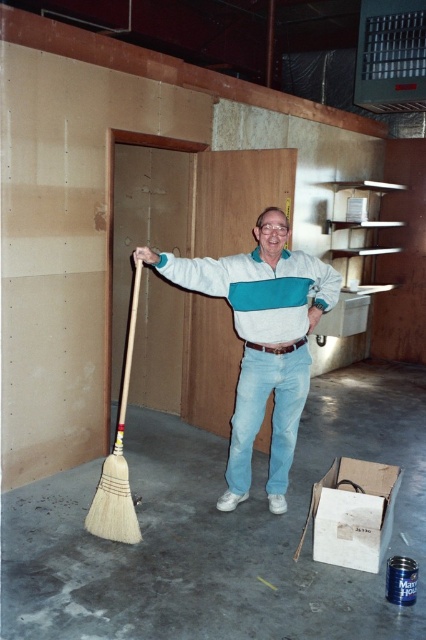
You are a worker in the construction site and you see the white cotton sweater at center and the white bristle broom at lower left. Which object is taller?

The white cotton sweater at center is much taller than the white bristle broom at lower left according to the description.

You are a painter who needs to reach a high spot on the wall. You have two brooms available, the natural wood broom at center and the white bristle broom at lower left. Which broom should you choose to stand on to reach the high spot?

The white bristle broom at lower left is taller than the natural wood broom at center, so you should choose the white bristle broom at lower left to stand on to reach the high spot.

You are a drone operator trying to capture a photo of the man in the room. You notice two points in the image labeled as point 1 at coordinates point 1 at coordinates point (x=406, y=499) and point 2 at coordinates point (x=331, y=292). Which point is closer to the camera?

Point (x=406, y=499) is further to the camera than point (x=331, y=292), so point (x=331, y=292) is closer to the camera.